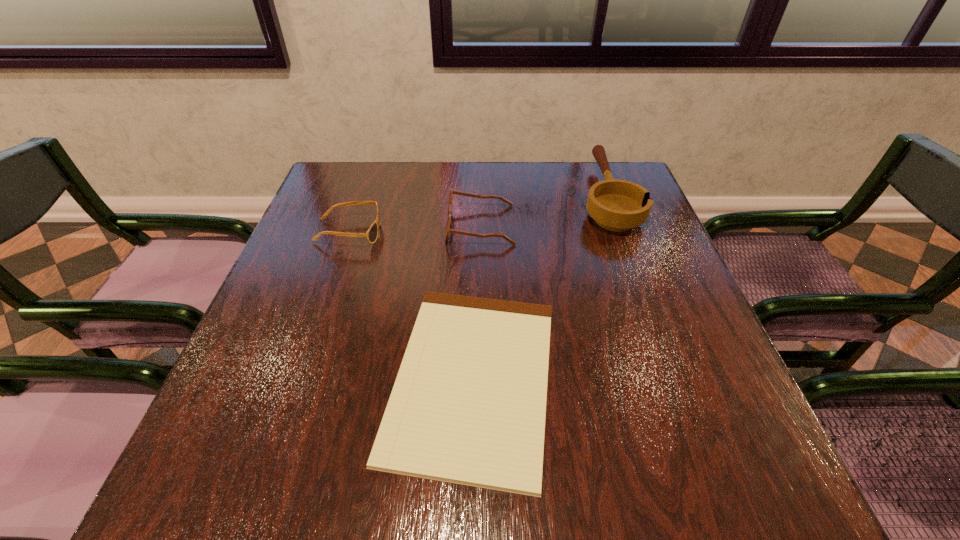
Where is `free point between the second shortest object and the saucepan`? The height and width of the screenshot is (540, 960). free point between the second shortest object and the saucepan is located at coordinates (477, 214).

Locate an element on the screen. The height and width of the screenshot is (540, 960). object that ranks as the closest to the nearest object is located at coordinates (448, 230).

Identify the location of object that is the closest one to the sunglasses. This screenshot has height=540, width=960. (448, 230).

Locate an element on the screen. Image resolution: width=960 pixels, height=540 pixels. free spot that satisfies the following two spatial constraints: 1. on the back side of the clipboard; 2. on the front-facing side of the leftmost object is located at coordinates (475, 232).